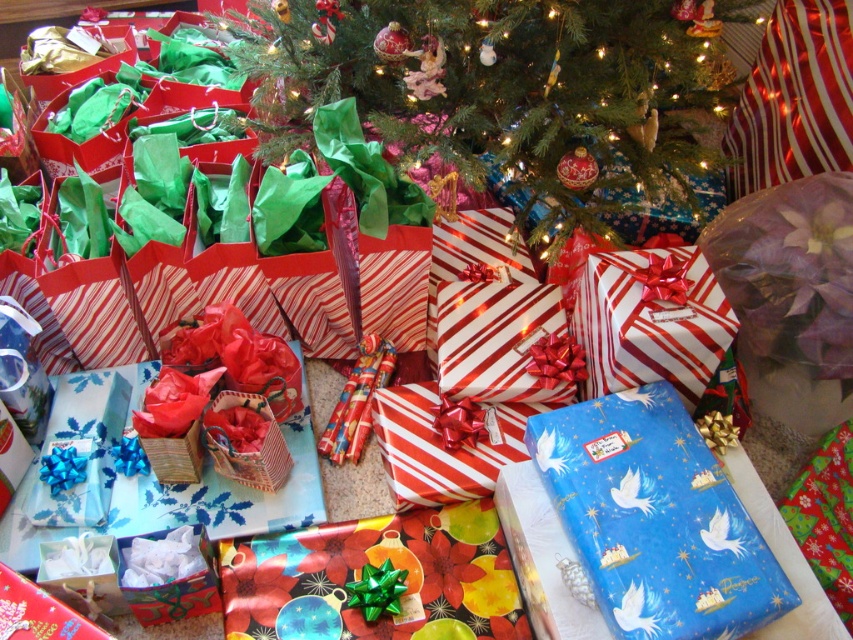
Question: Among these objects, which one is farthest from the camera?

Choices:
 (A) white striped paper gift at center
 (B) blue glossy gift at center

Answer: (A)

Question: Which point is closer to the camera taking this photo?

Choices:
 (A) (654, 628)
 (B) (490, 141)
 (C) (700, 352)

Answer: (A)

Question: Does blue glossy gift at center appear over white striped paper gift at center?

Choices:
 (A) no
 (B) yes

Answer: (A)

Question: Is blue glossy gift at center positioned behind white striped paper gift at center?

Choices:
 (A) no
 (B) yes

Answer: (A)

Question: Which of these objects is positioned closest to the green paper christmas tree at center?

Choices:
 (A) white striped paper gift at center
 (B) blue glossy gift at center

Answer: (A)

Question: Is green paper christmas tree at center to the right of white striped paper gift at center from the viewer's perspective?

Choices:
 (A) yes
 (B) no

Answer: (B)